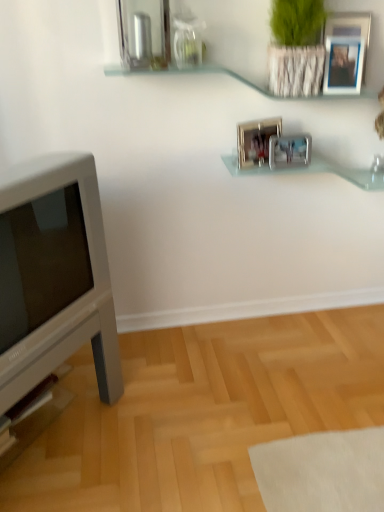
Question: Which direction should I rotate to face metallic silver picture frame at upper center, marked as the 1th picture frame in a right-to-left arrangement, — up or down?

Choices:
 (A) down
 (B) up

Answer: (B)

Question: Is white glossy television at left positioned before metallic silver picture frame at center, the second picture frame positioned from the bottom?

Choices:
 (A) no
 (B) yes

Answer: (B)

Question: Considering the relative sizes of white glossy television at left and metallic silver picture frame at center, the second picture frame positioned from the bottom, in the image provided, is white glossy television at left shorter than metallic silver picture frame at center, the second picture frame positioned from the bottom,?

Choices:
 (A) no
 (B) yes

Answer: (A)

Question: From the image's perspective, is white glossy television at left above metallic silver picture frame at center, which is the 3th picture frame in right-to-left order?

Choices:
 (A) no
 (B) yes

Answer: (A)

Question: Does white glossy television at left have a larger size compared to metallic silver picture frame at center, which is the 3th picture frame in right-to-left order?

Choices:
 (A) yes
 (B) no

Answer: (A)

Question: Can you confirm if white glossy television at left is positioned to the right of metallic silver picture frame at center, acting as the 2th picture frame starting from the top?

Choices:
 (A) no
 (B) yes

Answer: (A)

Question: From a real-world perspective, does white glossy television at left sit lower than metallic silver picture frame at center, the second picture frame positioned from the bottom?

Choices:
 (A) no
 (B) yes

Answer: (B)

Question: Considering the relative sizes of metallic silver picture frame at center, the second picture frame positioned from the bottom, and green textured plant at upper right in the image provided, is metallic silver picture frame at center, the second picture frame positioned from the bottom, shorter than green textured plant at upper right?

Choices:
 (A) no
 (B) yes

Answer: (B)

Question: Is metallic silver picture frame at center, acting as the 2th picture frame starting from the top, directly adjacent to green textured plant at upper right?

Choices:
 (A) no
 (B) yes

Answer: (A)

Question: From a real-world perspective, is metallic silver picture frame at center, which is the 3th picture frame in right-to-left order, located beneath green textured plant at upper right?

Choices:
 (A) no
 (B) yes

Answer: (B)

Question: Does metallic silver picture frame at center, arranged as the 1th picture frame when viewed from the left, have a lesser width compared to green textured plant at upper right?

Choices:
 (A) no
 (B) yes

Answer: (B)

Question: Could green textured plant at upper right be considered to be inside metallic silver picture frame at center, which is the 3th picture frame in right-to-left order?

Choices:
 (A) yes
 (B) no

Answer: (B)

Question: From the image's perspective, is metallic silver picture frame at center, which is the 3th picture frame in right-to-left order, over green textured plant at upper right?

Choices:
 (A) yes
 (B) no

Answer: (B)

Question: From the image's perspective, does clear glass shelf at upper center, the 1th shelf in the top-to-bottom sequence, appear higher than metallic silver picture frame at upper center, marked as the 1th picture frame in a right-to-left arrangement?

Choices:
 (A) no
 (B) yes

Answer: (A)